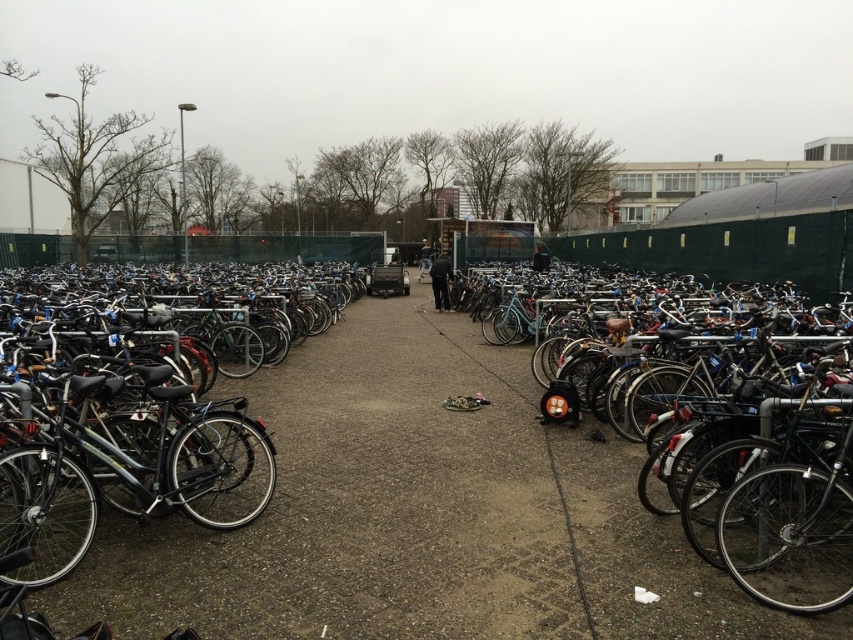
Question: Considering the real-world distances, which object is closest to the shiny metallic bicycle at right?

Choices:
 (A) shiny black bicycle at left
 (B) metallic silver helmet at center

Answer: (B)

Question: Can you confirm if shiny black bicycle at left is positioned below metallic silver helmet at center?

Choices:
 (A) yes
 (B) no

Answer: (B)

Question: Is shiny black bicycle at left above metallic silver helmet at center?

Choices:
 (A) yes
 (B) no

Answer: (A)

Question: Based on their relative distances, which object is farther from the shiny black bicycle at left?

Choices:
 (A) shiny metallic bicycle at right
 (B) metallic silver helmet at center

Answer: (A)

Question: Can you confirm if shiny metallic bicycle at right is positioned to the left of metallic silver helmet at center?

Choices:
 (A) no
 (B) yes

Answer: (A)

Question: Which object appears farthest from the camera in this image?

Choices:
 (A) metallic silver helmet at center
 (B) shiny metallic bicycle at right

Answer: (B)